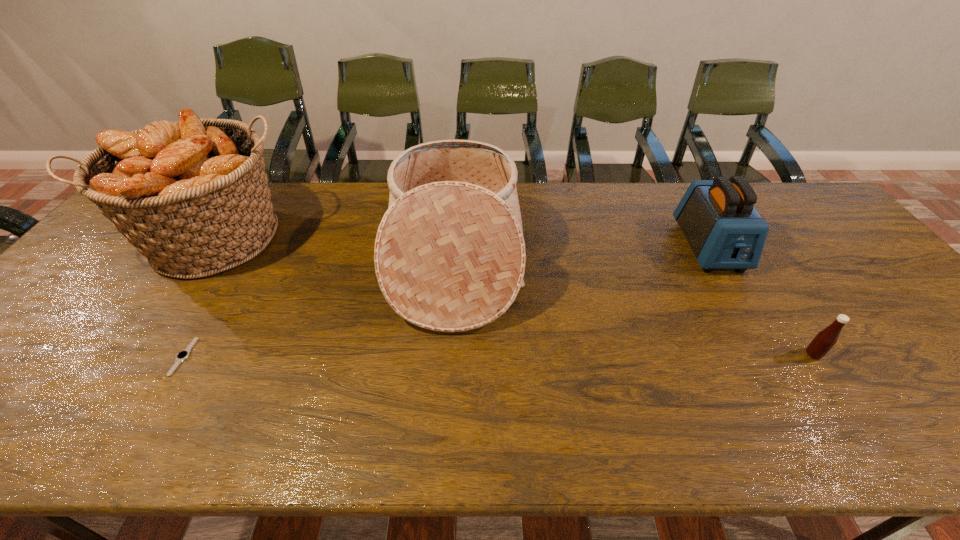
The height and width of the screenshot is (540, 960). Find the location of `object that ranks as the second closest to the toaster`. object that ranks as the second closest to the toaster is located at coordinates (449, 255).

Locate an element on the screen. This screenshot has height=540, width=960. free location that satisfies the following two spatial constraints: 1. on the front side of the watch; 2. on the left side of the left basket is located at coordinates (141, 356).

This screenshot has height=540, width=960. I want to click on vacant space that satisfies the following two spatial constraints: 1. with the lid open on the fourth tallest object; 2. on the right side of the shorter basket, so click(x=449, y=354).

Find the location of a particular element. This screenshot has height=540, width=960. vacant position in the image that satisfies the following two spatial constraints: 1. on the front side of the left basket; 2. on the right side of the watch is located at coordinates (141, 356).

This screenshot has width=960, height=540. What are the coordinates of `vacant region that satisfies the following two spatial constraints: 1. with the lid open on the Tabasco sauce; 2. on the right side of the right basket` in the screenshot? It's located at (449, 354).